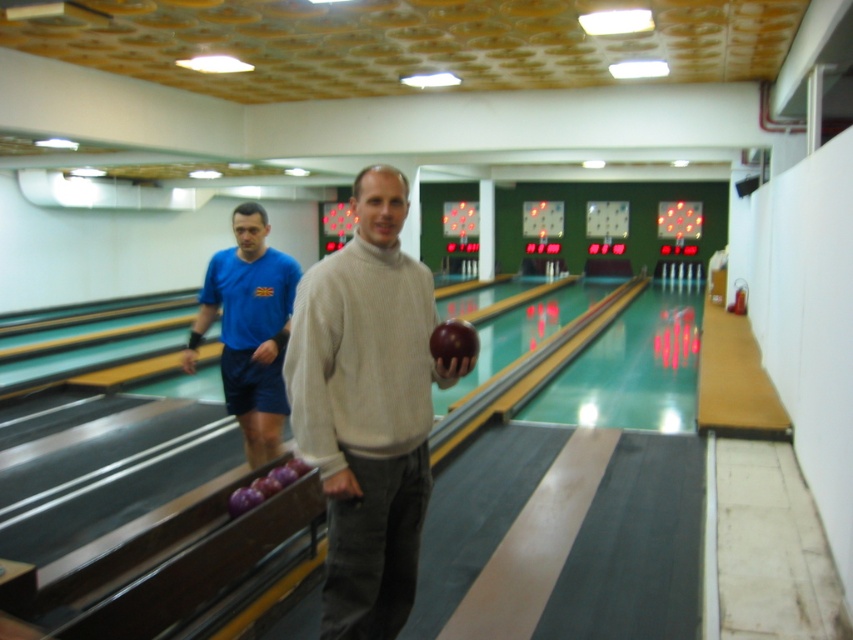
Question: Considering the relative positions of matte white sweater at center and blue fabric shorts at left in the image provided, where is matte white sweater at center located with respect to blue fabric shorts at left?

Choices:
 (A) left
 (B) right

Answer: (B)

Question: Which point is farther to the camera?

Choices:
 (A) (311, 282)
 (B) (262, 442)
 (C) (461, 346)

Answer: (B)

Question: Which of the following is the closest to the observer?

Choices:
 (A) (440, 339)
 (B) (260, 420)

Answer: (A)

Question: Is the position of blue fabric shorts at left more distant than that of shiny brown bowling ball at center?

Choices:
 (A) no
 (B) yes

Answer: (B)

Question: From the image, what is the correct spatial relationship of blue fabric shorts at left in relation to shiny brown bowling ball at center?

Choices:
 (A) right
 (B) left

Answer: (B)

Question: Which is farther from the blue fabric shorts at left?

Choices:
 (A) shiny brown bowling ball at center
 (B) matte white sweater at center

Answer: (A)